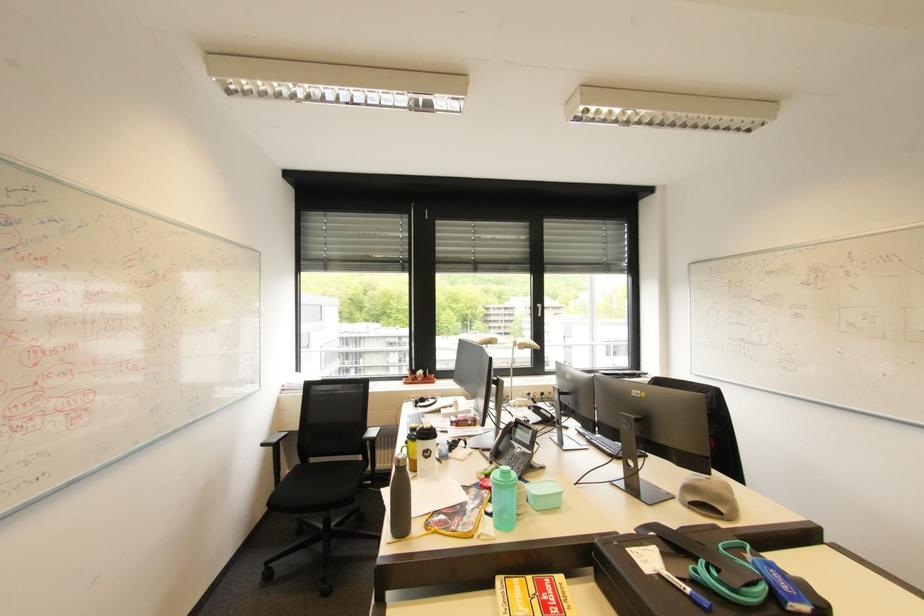
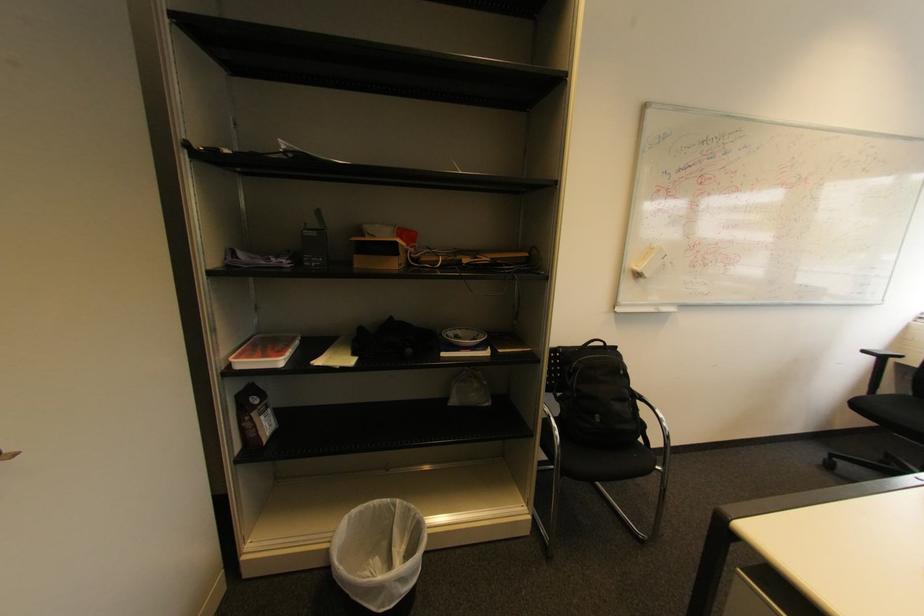
Question: The camera is either moving clockwise (left) or counter-clockwise (right) around the object. The first image is from the beginning of the video and the second image is from the end. Is the camera moving left or right when shooting the video?

Choices:
 (A) Left
 (B) Right

Answer: (B)